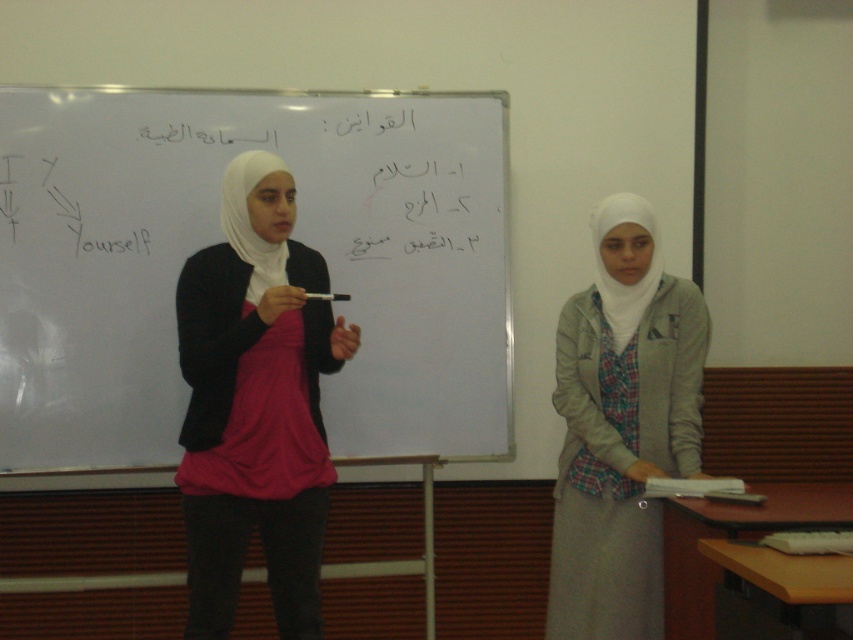
Who is taller, matte pink blouse at center or light gray fabric hijab at right?

With more height is matte pink blouse at center.

The width and height of the screenshot is (853, 640). What do you see at coordinates (254, 403) in the screenshot? I see `matte pink blouse at center` at bounding box center [254, 403].

I want to click on matte pink blouse at center, so click(254, 403).

Is white matte whiteboard at center shorter than light gray fabric hijab at right?

Indeed, white matte whiteboard at center has a lesser height compared to light gray fabric hijab at right.

Between white matte whiteboard at center and light gray fabric hijab at right, which one is positioned higher?

white matte whiteboard at center

Locate an element on the screen. The image size is (853, 640). white matte whiteboard at center is located at coordinates (221, 240).

Does white matte whiteboard at center have a greater width compared to matte pink blouse at center?

Correct, the width of white matte whiteboard at center exceeds that of matte pink blouse at center.

Does white matte whiteboard at center have a larger size compared to matte pink blouse at center?

Yes, white matte whiteboard at center is bigger than matte pink blouse at center.

Image resolution: width=853 pixels, height=640 pixels. What do you see at coordinates (221, 240) in the screenshot? I see `white matte whiteboard at center` at bounding box center [221, 240].

Locate an element on the screen. The height and width of the screenshot is (640, 853). white matte whiteboard at center is located at coordinates (221, 240).